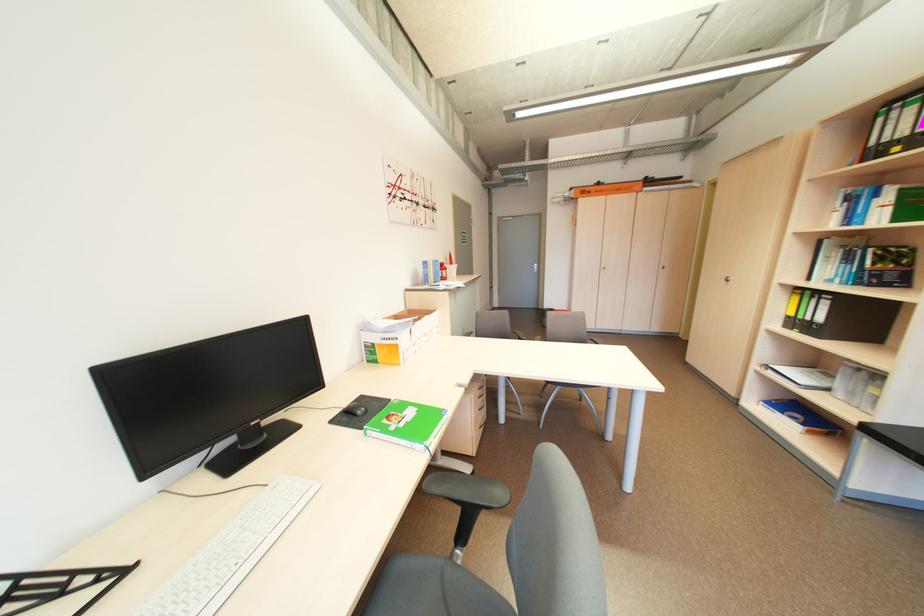
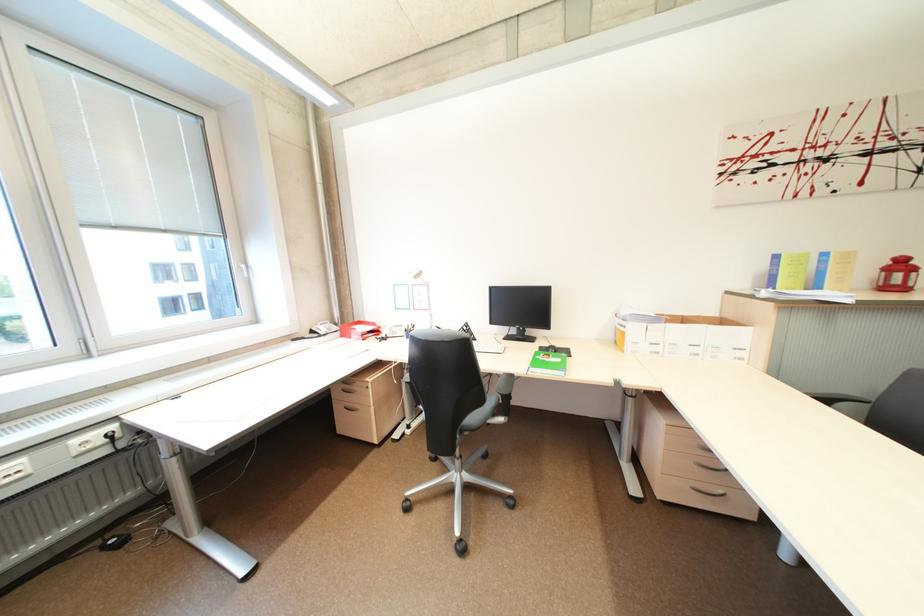
Where in the second image is the point corresponding to pixel 434 264 from the first image?

(785, 257)